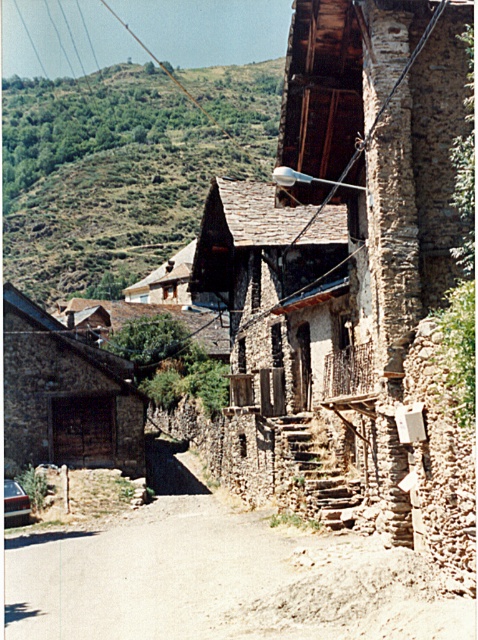
You are standing on the street looking uphill. Which object is positioned to the left of the other between the green grassy hillside at upper left and the metallic silver car at lower left?

The green grassy hillside at upper left is positioned to the left of the metallic silver car at lower left.